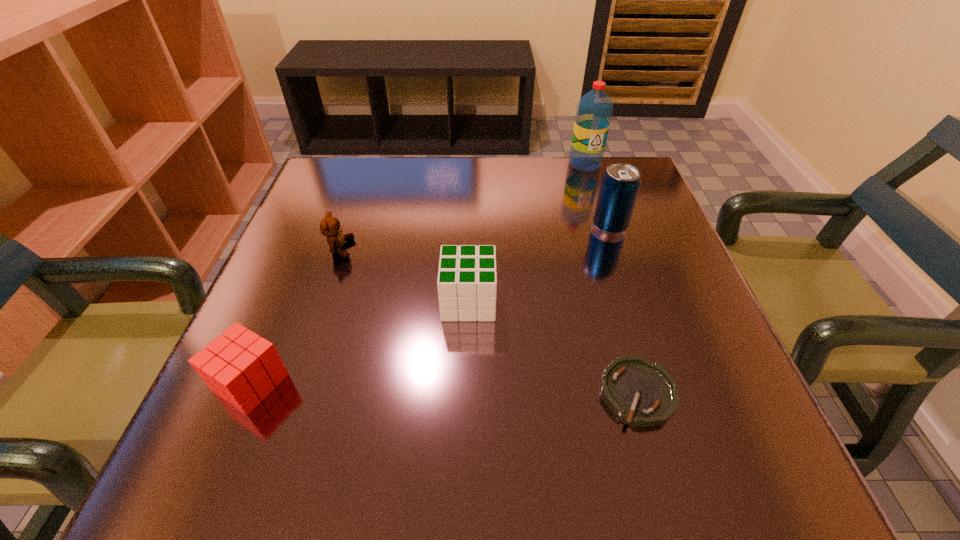
What are the coordinates of `vacant space in between the taller cube and the second tallest object` in the screenshot? It's located at (x=540, y=264).

Choose which object is the nearest neighbor to the fifth shortest object. Please provide its 2D coordinates. Your answer should be formatted as a tuple, i.e. [(x, y)], where the tuple contains the x and y coordinates of a point satisfying the conditions above.

[(594, 111)]

Choose which object is the fourth nearest neighbor to the farthest object. Please provide its 2D coordinates. Your answer should be formatted as a tuple, i.e. [(x, y)], where the tuple contains the x and y coordinates of a point satisfying the conditions above.

[(643, 393)]

At what (x,y) coordinates should I click in order to perform the action: click on free spot that satisfies the following two spatial constraints: 1. on the front side of the soda can; 2. on the red face of the fourth object from right to left. Please return your answer as a coordinate pair (x, y). Looking at the image, I should click on (635, 301).

At what (x,y) coordinates should I click in order to perform the action: click on free spot that satisfies the following two spatial constraints: 1. on the front label of the second tallest object; 2. on the left side of the water bottle. Please return your answer as a coordinate pair (x, y). Looking at the image, I should click on (605, 226).

Where is `free space that satisfies the following two spatial constraints: 1. on the back side of the shortest object; 2. on the red face of the fourth object from right to left`? free space that satisfies the following two spatial constraints: 1. on the back side of the shortest object; 2. on the red face of the fourth object from right to left is located at coordinates (612, 301).

The width and height of the screenshot is (960, 540). Find the location of `free location that satisfies the following two spatial constraints: 1. on the red face of the third object from left to right; 2. on the front side of the nearer cube`. free location that satisfies the following two spatial constraints: 1. on the red face of the third object from left to right; 2. on the front side of the nearer cube is located at coordinates click(x=467, y=383).

Image resolution: width=960 pixels, height=540 pixels. I want to click on free point that satisfies the following two spatial constraints: 1. on the front label of the farthest object; 2. on the front-facing side of the teddy bear, so click(x=612, y=248).

Locate an element on the screen. vacant space that satisfies the following two spatial constraints: 1. on the front-facing side of the shortest object; 2. on the right side of the teddy bear is located at coordinates (292, 393).

In order to click on vacant space that satisfies the following two spatial constraints: 1. on the front-facing side of the teddy bear; 2. on the right side of the ashtray in this screenshot , I will do `click(292, 393)`.